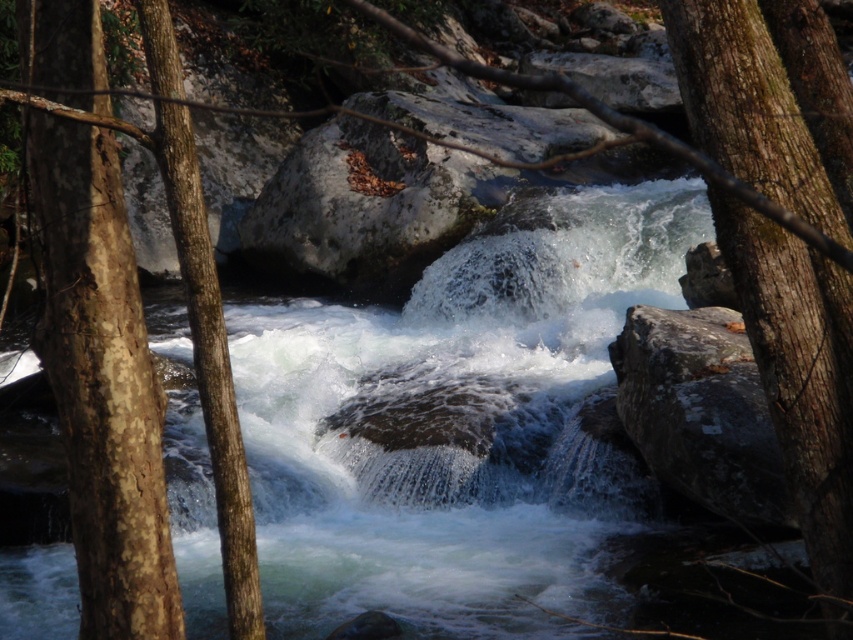
Question: Which point is closer to the camera taking this photo?

Choices:
 (A) (781, 232)
 (B) (650, 394)

Answer: (A)

Question: Does brown rough bark tree at right have a smaller size compared to gray/rough rock at center-right?

Choices:
 (A) yes
 (B) no

Answer: (A)

Question: Which object is closer to the camera taking this photo?

Choices:
 (A) gray/rough rock at center-right
 (B) brown rough bark tree at right

Answer: (B)

Question: Can you confirm if brown rough bark tree at right is positioned to the right of gray/rough rock at center-right?

Choices:
 (A) no
 (B) yes

Answer: (A)

Question: Does brown rough bark tree at right appear on the left side of gray/rough rock at center-right?

Choices:
 (A) no
 (B) yes

Answer: (B)